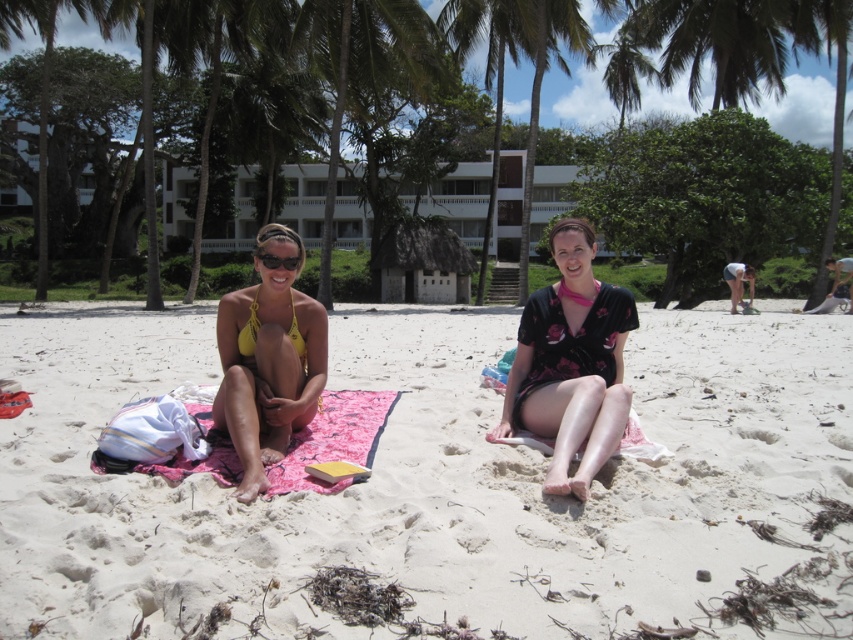
Between black floral dress at center and green leafy palm tree at upper left, which one is positioned higher?

Positioned higher is green leafy palm tree at upper left.

Can you confirm if black floral dress at center is positioned to the right of green leafy palm tree at upper left?

Indeed, black floral dress at center is positioned on the right side of green leafy palm tree at upper left.

Which is in front, point (582, 422) or point (39, 182)?

Point (582, 422) is in front.

Where is `black floral dress at center`? The image size is (853, 640). black floral dress at center is located at coordinates (572, 364).

Which is above, green leafy palm tree at upper center or green leafy palm tree at upper left?

green leafy palm tree at upper center is higher up.

Is green leafy palm tree at upper center smaller than green leafy palm tree at upper left?

Yes.

Which is behind, point (534, 122) or point (102, 13)?

Point (102, 13)

Locate an element on the screen. The height and width of the screenshot is (640, 853). green leafy palm tree at upper center is located at coordinates (540, 88).

Which is more to the right, white sandy beach at center or pink fabric blanket at center?

From the viewer's perspective, white sandy beach at center appears more on the right side.

Which is in front, point (204, 529) or point (213, 432)?

Point (204, 529)

Does point (62, 630) lie behind point (277, 484)?

No, (62, 630) is closer to viewer.

You are a GUI agent. You are given a task and a screenshot of the screen. Output one action in this format:
    pyautogui.click(x=<x>, y=<y>)
    Task: Click on the white sandy beach at center
    The image size is (853, 640).
    Given the screenshot: What is the action you would take?
    pyautogui.click(x=428, y=481)